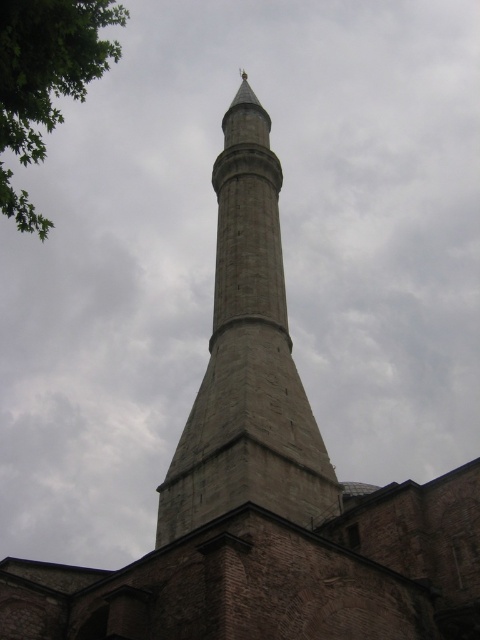
You are standing in a plaza in front of a mosque and see the gray stone minaret at center. If you want to take a photo that captures the entire height of the minaret, how far back should you move from your current position?

The gray stone minaret at center is 49.03 meters from viewer. To capture its entire height in a photo, you should move back to a distance of at least 49.03 meters or more to ensure the camera can encompass the full height of the structure.

You are an architect analyzing the image of a minaret and a tree. According to the scene, which object has a greater width when comparing the gray stone minaret at center and the green leafy tree at upper left?

The green leafy tree at upper left has a greater width than the gray stone minaret at center.